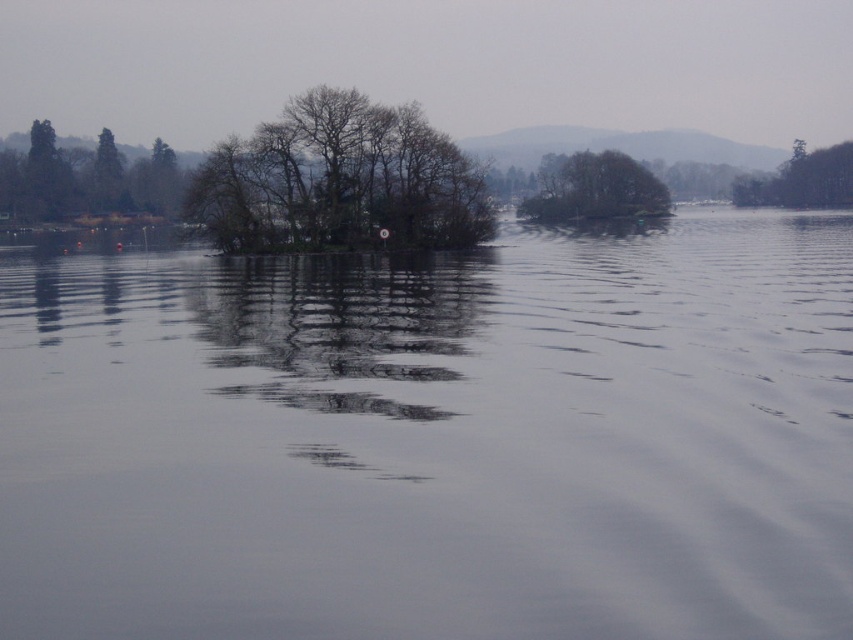
You are a bird flying over the lake and need to land on the nearest land. You see the green matte trees at upper left. Based on their position, which direction should you head towards to find the closest land?

The green matte trees at upper left are located at point (86, 179), so you should head towards the upper left direction to find the closest land.

Looking at this image, you are an environmental scientist assessing the scene. You need to determine which area has more space available for potential ecological restoration projects. Based on the sizes of the transparent water at center and the green matte trees at upper left, which one offers more space for restoration activities?

The transparent water at center has a larger size compared to the green matte trees at upper left, so it offers more space for ecological restoration activities.

In the scene shown: You are a bird flying over the lake and want to land on the island. You see the transparent water at center and the green matte trees at upper left. Which one is closer to your current position?

The transparent water at center is closer to your current position because it is only 222.86 feet away from the green matte trees at upper left, so whichever is closer depends on your starting point. Wait, the description says the distance between them is 222.86 feet, but the question is about which is closer to the bird. Since the bird is flying over the lake, maybe the water is directly below, so the water is closer. Hmm, need to clarify based on given info.